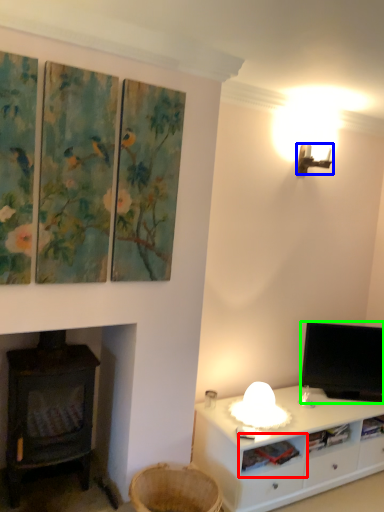
Question: Which is nearer to the shelf (highlighted by a red box)? lamp (highlighted by a blue box) or television (highlighted by a green box).

Choices:
 (A) lamp
 (B) television

Answer: (B)